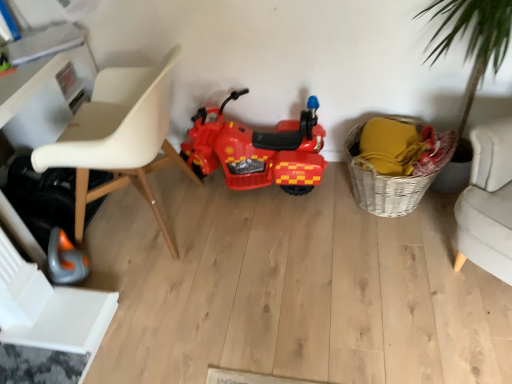
Image resolution: width=512 pixels, height=384 pixels. I want to click on vacant space that's between white plastic chair at left and white plastic swivel chair at lower left, so click(141, 288).